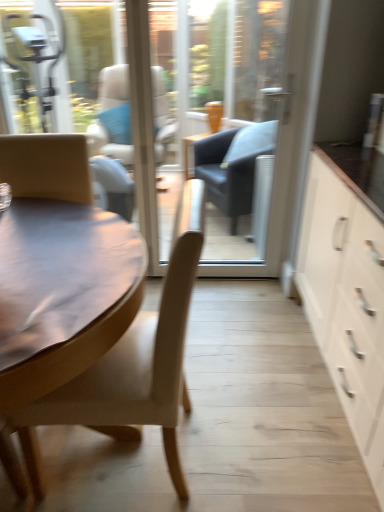
Question: In terms of width, does white matte cabinet at right look wider or thinner when compared to matte brown chair at left?

Choices:
 (A) thin
 (B) wide

Answer: (A)

Question: Is white matte cabinet at right bigger or smaller than matte brown chair at left?

Choices:
 (A) small
 (B) big

Answer: (B)

Question: Considering the real-world distances, which object is closest to the white matte cabinet at right?

Choices:
 (A) matte brown chair at left
 (B) transparent glass door at center

Answer: (A)

Question: Which of these objects is positioned closest to the matte brown chair at left?

Choices:
 (A) transparent glass door at center
 (B) white matte cabinet at right

Answer: (B)